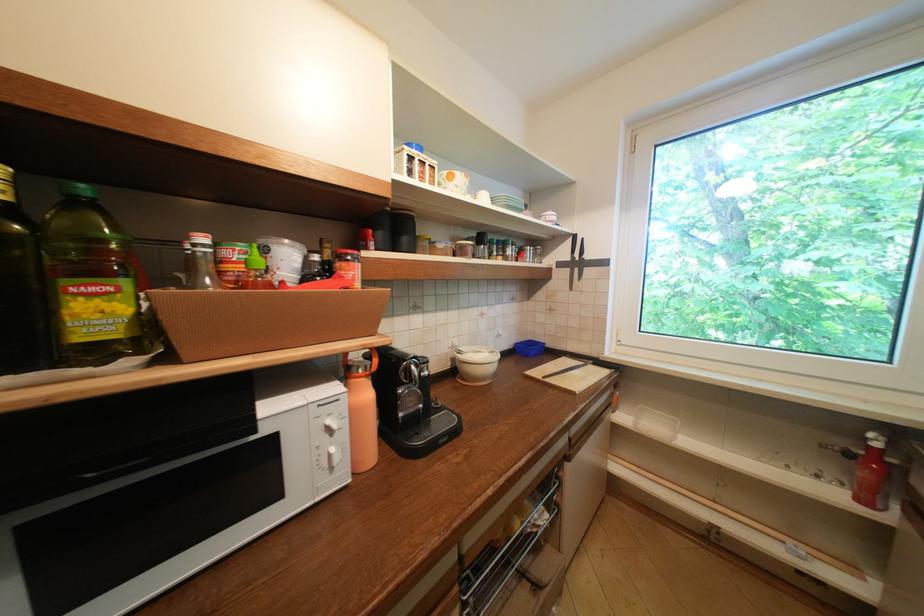
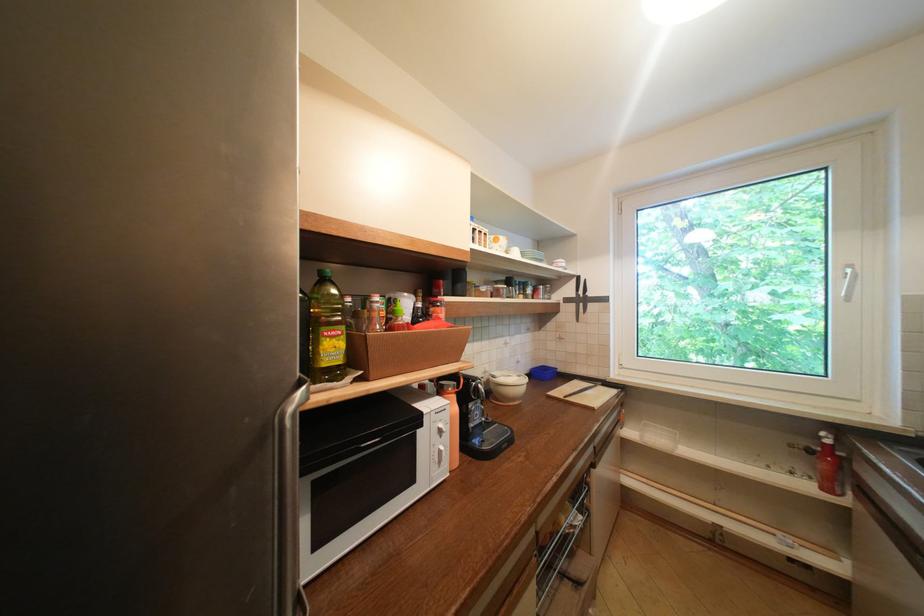
Where in the second image is the point corresponding to point (538, 532) from the first image?

(576, 532)